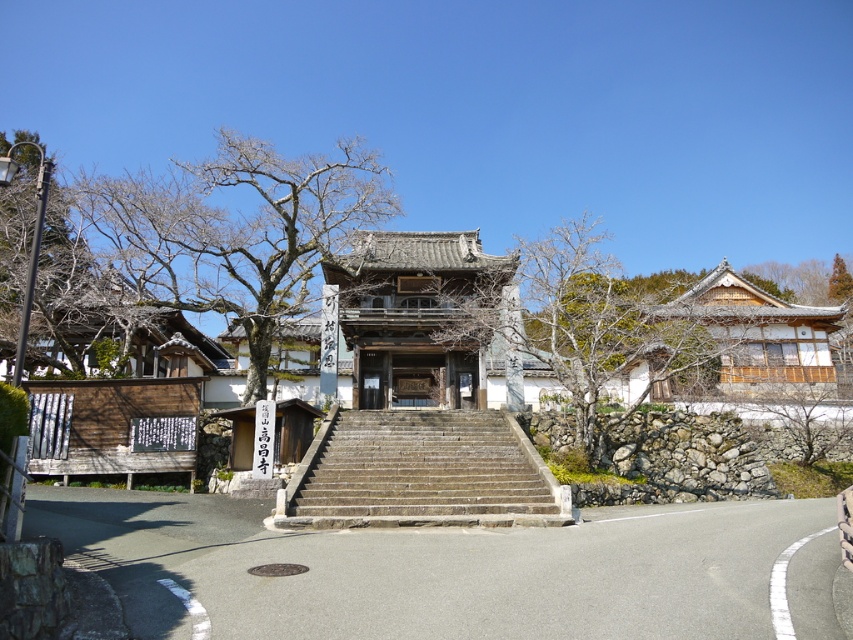
Between stone textured stairs at center and bare wood tree at center, which one is positioned lower?

stone textured stairs at center

Does stone textured stairs at center appear on the left side of bare wood tree at center?

Indeed, stone textured stairs at center is positioned on the left side of bare wood tree at center.

Image resolution: width=853 pixels, height=640 pixels. What do you see at coordinates (421, 474) in the screenshot?
I see `stone textured stairs at center` at bounding box center [421, 474].

You are a GUI agent. You are given a task and a screenshot of the screen. Output one action in this format:
    pyautogui.click(x=<x>, y=<y>)
    Task: Click on the stone textured stairs at center
    Image resolution: width=853 pixels, height=640 pixels.
    Given the screenshot: What is the action you would take?
    pyautogui.click(x=421, y=474)

Who is positioned more to the left, wooden temple at center or bare wood tree at left?

Positioned to the left is bare wood tree at left.

Does wooden temple at center appear over bare wood tree at left?

Yes, wooden temple at center is above bare wood tree at left.

Image resolution: width=853 pixels, height=640 pixels. I want to click on wooden temple at center, so click(x=415, y=316).

Is wooden temple at center shorter than bare wood tree at center?

Correct, wooden temple at center is not as tall as bare wood tree at center.

Who is positioned more to the right, wooden temple at center or bare wood tree at center?

bare wood tree at center is more to the right.

Is point (396, 257) more distant than point (589, 276)?

That is True.

I want to click on wooden temple at center, so click(415, 316).